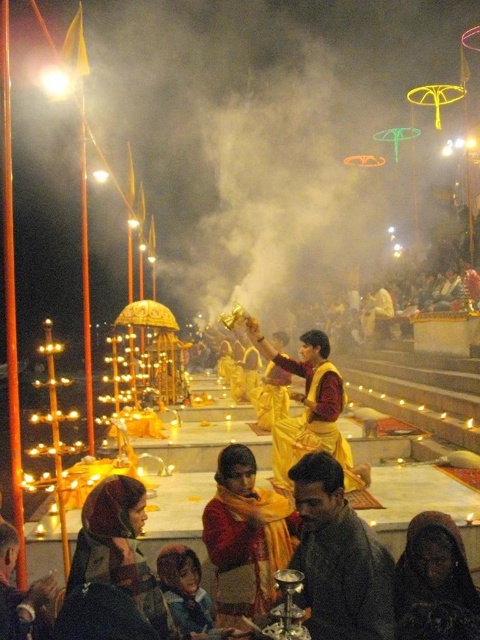
Who is lower down, yellow fabric shawl at center or dark fabric headscarf at lower right?

yellow fabric shawl at center is below.

You are a GUI agent. You are given a task and a screenshot of the screen. Output one action in this format:
    pyautogui.click(x=<x>, y=<y>)
    Task: Click on the yellow fabric shawl at center
    Image resolution: width=480 pixels, height=640 pixels.
    Given the screenshot: What is the action you would take?
    pyautogui.click(x=245, y=536)

Locate an element on the screen. The width and height of the screenshot is (480, 640). yellow fabric shawl at center is located at coordinates (245, 536).

Does yellow fabric shawl at center have a greater height compared to yellow silk robe at center?

Yes.

Does yellow fabric shawl at center come behind yellow silk robe at center?

No.

Is point (240, 506) positioned behind point (310, 436)?

That is False.

Image resolution: width=480 pixels, height=640 pixels. In order to click on yellow fabric shawl at center in this screenshot , I will do `click(245, 536)`.

Is dark fabric headscarf at lower right positioned at the back of yellow silk robe at center?

No, it is not.

Measure the distance between point (445, 592) and camera.

Point (445, 592) and camera are 41.24 feet apart.

Between point (417, 602) and point (321, 380), which one is positioned behind?

The point (321, 380) is more distant.

Identify the location of dark fabric headscarf at lower right. click(434, 582).